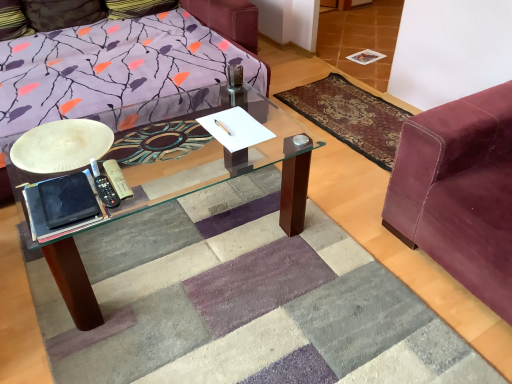
What is the approximate height of velvet-like burgundy mat at right?

velvet-like burgundy mat at right is 0.94 inches tall.

The height and width of the screenshot is (384, 512). Describe the element at coordinates (459, 192) in the screenshot. I see `velvet maroon couch at right` at that location.

Locate an element on the screen. The image size is (512, 384). velvet pillow at upper left is located at coordinates (137, 8).

Based on the photo, is velvet-like burgundy mat at right facing away from velvet pillow at upper left?

No, velvet-like burgundy mat at right is not facing the opposite direction of velvet pillow at upper left.

From the image's perspective, is velvet-like burgundy mat at right located above velvet pillow at upper left?

No, from the image's perspective, velvet-like burgundy mat at right is not above velvet pillow at upper left.

Is point (355, 122) behind point (141, 10)?

That is False.

The height and width of the screenshot is (384, 512). Identify the location of studio couch that appears on the right of white matte plate at left. (459, 192).

Considering the relative sizes of velvet maroon couch at right and white matte plate at left in the image provided, is velvet maroon couch at right thinner than white matte plate at left?

Incorrect, the width of velvet maroon couch at right is not less than that of white matte plate at left.

Does point (456, 231) come behind point (32, 154)?

That is True.

From a real-world perspective, who is located higher, velvet pillow at upper left or white matte plate at left?

white matte plate at left, from a real-world perspective.

How different are the orientations of velvet pillow at upper left and white matte plate at left in degrees?

0.137 degrees separate the facing orientations of velvet pillow at upper left and white matte plate at left.

Is point (174, 3) farther from viewer compared to point (78, 136)?

Yes, point (174, 3) is farther from viewer.

Based on their sizes in the image, would you say velvet pillow at upper left is bigger or smaller than white matte plate at left?

velvet pillow at upper left is bigger than white matte plate at left.

Measure the distance between velvet maroon couch at right and velvet pillow at upper left.

velvet maroon couch at right is 2.36 meters away from velvet pillow at upper left.

From the image's perspective, between velvet maroon couch at right and velvet pillow at upper left, who is located below?

velvet maroon couch at right appears lower in the image.

Is velvet maroon couch at right oriented towards velvet pillow at upper left?

No, velvet maroon couch at right is not oriented towards velvet pillow at upper left.

Is point (457, 204) more distant than point (151, 4)?

No, (457, 204) is closer to viewer.

Between point (112, 132) and point (148, 10), which one is positioned behind?

Positioned behind is point (148, 10).

Measure the distance between white matte plate at left and velvet pillow at upper left.

A distance of 1.74 meters exists between white matte plate at left and velvet pillow at upper left.

In the image, there is a white matte plate at left. At what (x,y) coordinates should I click in order to perform the action: click on pillow below it (from a real-world perspective). Please return your answer as a coordinate pair (x, y). This screenshot has height=384, width=512. Looking at the image, I should click on (137, 8).

From the image's perspective, is white matte plate at left under velvet pillow at upper left?

Correct, white matte plate at left appears lower than velvet pillow at upper left in the image.

How different are the orientations of velvet maroon couch at right and velvet-like burgundy mat at right in degrees?

They differ by 3.13 degrees in their facing directions.

Looking at the image, does velvet maroon couch at right seem bigger or smaller compared to velvet-like burgundy mat at right?

Considering their sizes, velvet maroon couch at right takes up more space than velvet-like burgundy mat at right.

Which is in front, velvet maroon couch at right or velvet-like burgundy mat at right?

Positioned in front is velvet maroon couch at right.

Is velvet-like burgundy mat at right not near velvet maroon couch at right?

velvet-like burgundy mat at right is actually quite close to velvet maroon couch at right.

Can you confirm if velvet-like burgundy mat at right is thinner than velvet maroon couch at right?

Correct, the width of velvet-like burgundy mat at right is less than that of velvet maroon couch at right.

Is velvet-like burgundy mat at right oriented away from velvet maroon couch at right?

No.

From a real-world perspective, is velvet-like burgundy mat at right physically above velvet maroon couch at right?

Actually, velvet-like burgundy mat at right is physically below velvet maroon couch at right in the real world.

Identify the location of mat that is below the velvet pillow at upper left (from the image's perspective). This screenshot has width=512, height=384. (350, 116).

Identify the location of round table above the velvet maroon couch at right (from the image's perspective). The width and height of the screenshot is (512, 384). (61, 146).

When comparing their distances from velvet maroon couch at right, does velvet pillow at upper left or velvet-like burgundy mat at right seem closer?

velvet-like burgundy mat at right is closer to velvet maroon couch at right.

From the image, which object appears to be nearer to velvet pillow at upper left, white matte plate at left or velvet maroon couch at right?

white matte plate at left is positioned closer to the anchor velvet pillow at upper left.

Considering their positions, is velvet maroon couch at right positioned further to white matte plate at left than velvet-like burgundy mat at right?

velvet-like burgundy mat at right lies further to white matte plate at left than the other object.

Which object lies further to the anchor point velvet maroon couch at right, velvet pillow at upper left or white matte plate at left?

velvet pillow at upper left is positioned further to the anchor velvet maroon couch at right.

Looking at this image, from the image, which object appears to be nearer to white matte plate at left, velvet pillow at upper left or velvet-like burgundy mat at right?

The object closer to white matte plate at left is velvet-like burgundy mat at right.

Looking at the image, which one is located closer to white matte plate at left, velvet-like burgundy mat at right or velvet maroon couch at right?

velvet maroon couch at right is closer to white matte plate at left.

Considering their positions, is velvet maroon couch at right positioned closer to velvet-like burgundy mat at right than velvet pillow at upper left?

velvet maroon couch at right is positioned closer to the anchor velvet-like burgundy mat at right.

From the image, which object appears to be nearer to velvet-like burgundy mat at right, velvet pillow at upper left or velvet maroon couch at right?

velvet maroon couch at right is closer to velvet-like burgundy mat at right.

This screenshot has height=384, width=512. Identify the location of round table located between velvet pillow at upper left and velvet maroon couch at right in the left-right direction. (61, 146).

This screenshot has width=512, height=384. Find the location of `round table between velvet pillow at upper left and velvet-like burgundy mat at right from left to right`. round table between velvet pillow at upper left and velvet-like burgundy mat at right from left to right is located at coordinates (61, 146).

The height and width of the screenshot is (384, 512). What are the coordinates of `mat between white matte plate at left and velvet maroon couch at right from left to right` in the screenshot? It's located at (350, 116).

Locate an element on the screen. The image size is (512, 384). mat between velvet pillow at upper left and velvet maroon couch at right from left to right is located at coordinates (350, 116).